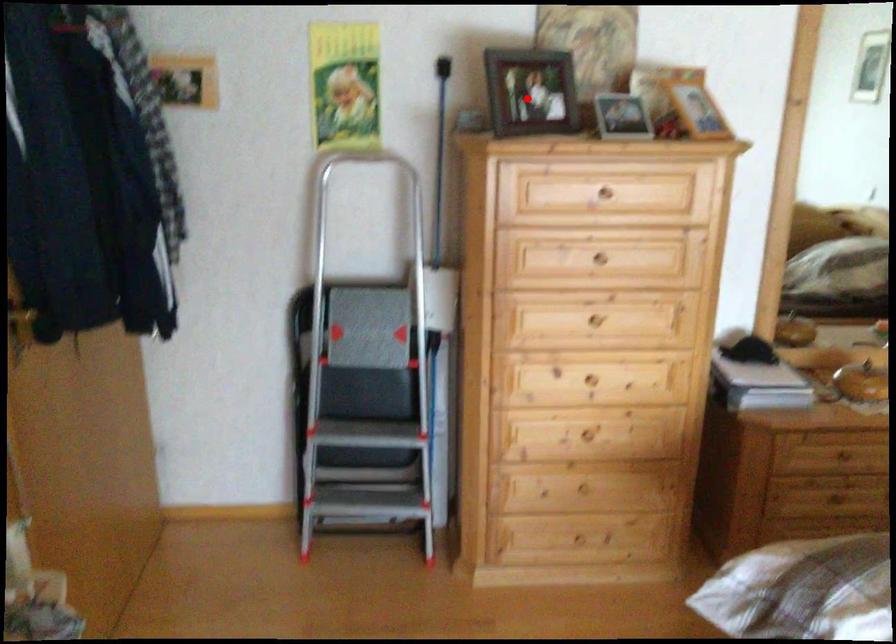
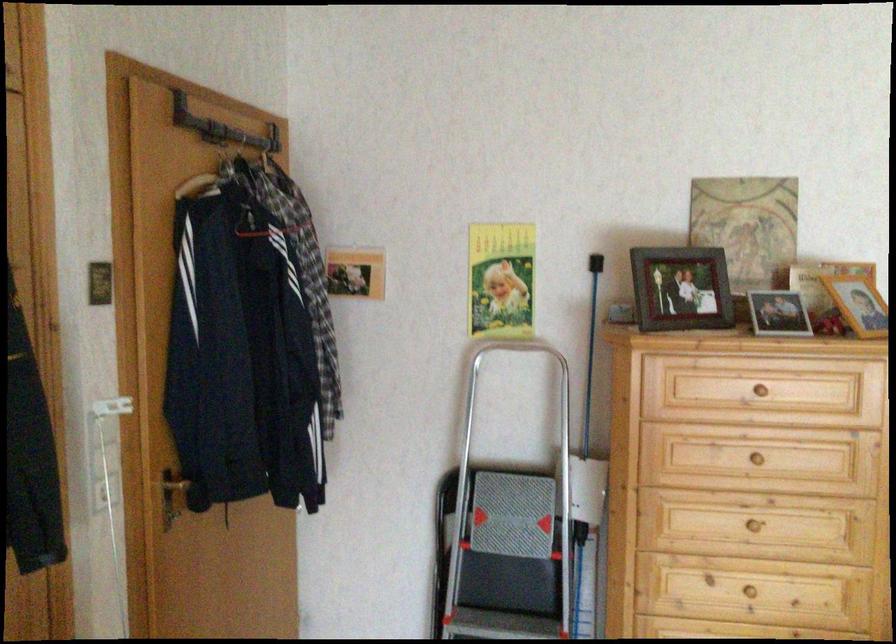
In the second image, find the point that corresponds to the highlighted location in the first image.

(681, 289)